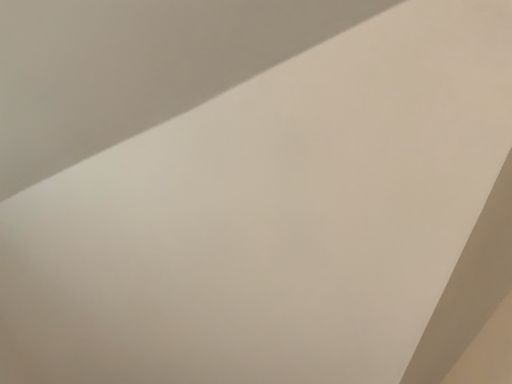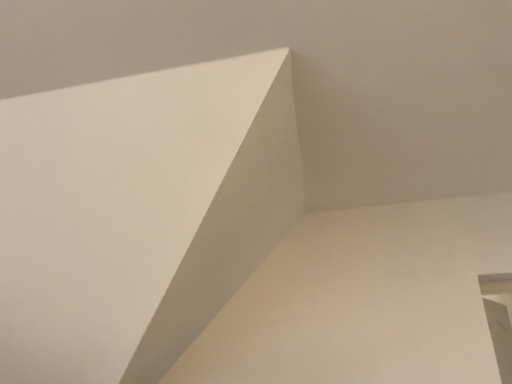
Question: Which way did the camera rotate in the video?

Choices:
 (A) rotated downward
 (B) rotated upward

Answer: (A)